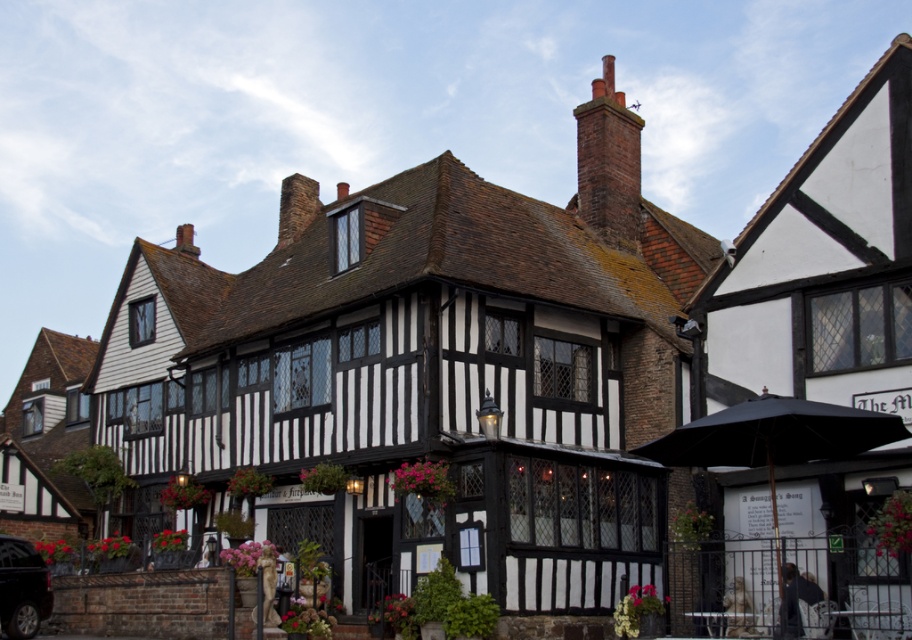
Between red brick chimney at upper center and shiny black car at lower left, which one appears on the right side from the viewer's perspective?

red brick chimney at upper center is more to the right.

Is point (586, 172) more distant than point (42, 605)?

Yes, it is.

Where is `red brick chimney at upper center`? red brick chimney at upper center is located at coordinates point(608,161).